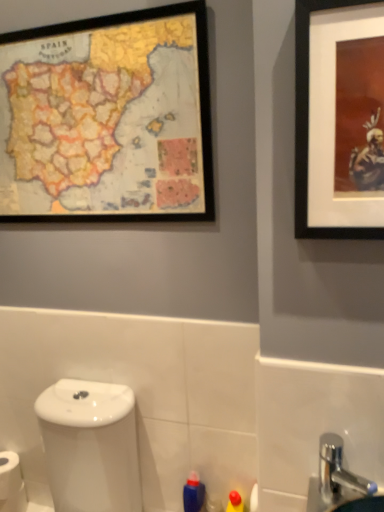
This screenshot has width=384, height=512. What do you see at coordinates (11, 483) in the screenshot? I see `white matte toilet paper at lower left` at bounding box center [11, 483].

Where is `white glossy toilet at lower left`? Image resolution: width=384 pixels, height=512 pixels. white glossy toilet at lower left is located at coordinates (90, 446).

Identify the location of blue plastic bottle at lower center. click(193, 493).

In the scene shown: Would you say silver metallic faucet at lower right is a long distance from white glossy toilet at lower left?

silver metallic faucet at lower right is actually quite close to white glossy toilet at lower left.

Consider the image. Which is more to the right, silver metallic faucet at lower right or white glossy toilet at lower left?

From the viewer's perspective, silver metallic faucet at lower right appears more on the right side.

Is point (325, 471) closer or farther from the camera than point (59, 398)?

Point (325, 471) appears to be closer to the viewer than point (59, 398).

From a real-world perspective, who is located lower, silver metallic faucet at lower right or white glossy toilet at lower left?

white glossy toilet at lower left.

Is blue plastic bottle at lower center looking in the opposite direction of black matte picture frame at upper right, which is counted as the second picture frame, starting from the left?

No, blue plastic bottle at lower center is not facing the opposite direction of black matte picture frame at upper right, which is counted as the second picture frame, starting from the left.

From a real-world perspective, does blue plastic bottle at lower center stand above black matte picture frame at upper right, the second picture frame positioned from the back?

No, from a real-world perspective, blue plastic bottle at lower center is not above black matte picture frame at upper right, the second picture frame positioned from the back.

Is blue plastic bottle at lower center further to the viewer compared to black matte picture frame at upper right, which is counted as the second picture frame, starting from the left?

Yes, the depth of blue plastic bottle at lower center is greater than that of black matte picture frame at upper right, which is counted as the second picture frame, starting from the left.

Find the location of `picture frame that is the 1st one above the blue plastic bottle at lower center (from a real-world perspective)`. picture frame that is the 1st one above the blue plastic bottle at lower center (from a real-world perspective) is located at coordinates (339, 119).

Considering the sizes of objects wooden map at upper left, which is counted as the 2th picture frame, starting from the front, and white matte toilet paper at lower left in the image provided, who is wider, wooden map at upper left, which is counted as the 2th picture frame, starting from the front, or white matte toilet paper at lower left?

With larger width is white matte toilet paper at lower left.

From the image's perspective, does wooden map at upper left, which is counted as the 2th picture frame, starting from the right, appear higher than white matte toilet paper at lower left?

Yes.

From a real-world perspective, is wooden map at upper left, acting as the 1th picture frame starting from the left, on white matte toilet paper at lower left?

Yes, from a real-world perspective, wooden map at upper left, acting as the 1th picture frame starting from the left, is over white matte toilet paper at lower left

Considering the positions of objects black matte picture frame at upper right, which is counted as the first picture frame, starting from the front, and white matte toilet paper at lower left in the image provided, who is more to the left, black matte picture frame at upper right, which is counted as the first picture frame, starting from the front, or white matte toilet paper at lower left?

Positioned to the left is white matte toilet paper at lower left.

Is black matte picture frame at upper right, which is counted as the first picture frame, starting from the front, taller or shorter than white matte toilet paper at lower left?

black matte picture frame at upper right, which is counted as the first picture frame, starting from the front, is taller than white matte toilet paper at lower left.

Considering the positions of points (309, 113) and (20, 472), is point (309, 113) closer to camera compared to point (20, 472)?

Yes, it is in front of point (20, 472).

Considering the relative sizes of black matte picture frame at upper right, which is the 1th picture frame from right to left, and white matte toilet paper at lower left in the image provided, is black matte picture frame at upper right, which is the 1th picture frame from right to left, wider than white matte toilet paper at lower left?

No, black matte picture frame at upper right, which is the 1th picture frame from right to left, is not wider than white matte toilet paper at lower left.

From a real-world perspective, who is located higher, silver metallic faucet at lower right or wooden map at upper left, acting as the first picture frame starting from the back?

From a 3D spatial view, wooden map at upper left, acting as the first picture frame starting from the back, is above.

Looking at this image, is silver metallic faucet at lower right facing towards wooden map at upper left, which is counted as the 2th picture frame, starting from the right?

No, silver metallic faucet at lower right is not turned towards wooden map at upper left, which is counted as the 2th picture frame, starting from the right.

Is silver metallic faucet at lower right positioned beyond the bounds of wooden map at upper left, acting as the 1th picture frame starting from the left?

Yes, silver metallic faucet at lower right is located beyond the bounds of wooden map at upper left, acting as the 1th picture frame starting from the left.

From a real-world perspective, which is physically below, wooden map at upper left, which is counted as the 2th picture frame, starting from the right, or white glossy toilet at lower left?

In real-world perspective, white glossy toilet at lower left is lower.

Measure the distance between wooden map at upper left, which is counted as the 2th picture frame, starting from the right, and white glossy toilet at lower left.

wooden map at upper left, which is counted as the 2th picture frame, starting from the right, is 29.01 inches away from white glossy toilet at lower left.

Based on their sizes in the image, would you say wooden map at upper left, acting as the 1th picture frame starting from the left, is bigger or smaller than white glossy toilet at lower left?

In the image, wooden map at upper left, acting as the 1th picture frame starting from the left, appears to be smaller than white glossy toilet at lower left.

In terms of height, does white glossy toilet at lower left look taller or shorter compared to black matte picture frame at upper right, which is counted as the first picture frame, starting from the front?

Considering their sizes, white glossy toilet at lower left has more height than black matte picture frame at upper right, which is counted as the first picture frame, starting from the front.

From the image's perspective, is white glossy toilet at lower left beneath black matte picture frame at upper right, which is counted as the first picture frame, starting from the front?

Yes, from the image's perspective, white glossy toilet at lower left is beneath black matte picture frame at upper right, which is counted as the first picture frame, starting from the front.

Between white glossy toilet at lower left and black matte picture frame at upper right, which is the 1th picture frame from right to left, which one has smaller size?

black matte picture frame at upper right, which is the 1th picture frame from right to left, is smaller.

How much distance is there between white glossy toilet at lower left and black matte picture frame at upper right, the second picture frame positioned from the back?

white glossy toilet at lower left and black matte picture frame at upper right, the second picture frame positioned from the back, are 36.96 inches apart from each other.

In the image, there is a silver metallic faucet at lower right. Where is `toilet below it (from a real-world perspective)`? toilet below it (from a real-world perspective) is located at coordinates (90, 446).

You are a GUI agent. You are given a task and a screenshot of the screen. Output one action in this format:
    pyautogui.click(x=<x>, y=<y>)
    Task: Click on the picture frame on the right of the blue plastic bottle at lower center
    The height and width of the screenshot is (512, 384).
    Given the screenshot: What is the action you would take?
    pyautogui.click(x=339, y=119)

Which object lies nearer to the anchor point blue plastic bottle at lower center, wooden map at upper left, which is counted as the 2th picture frame, starting from the right, or white matte toilet paper at lower left?

white matte toilet paper at lower left is positioned closer to the anchor blue plastic bottle at lower center.

Estimate the real-world distances between objects in this image. Which object is closer to white matte toilet paper at lower left, silver metallic faucet at lower right or blue plastic bottle at lower center?

blue plastic bottle at lower center is positioned closer to the anchor white matte toilet paper at lower left.

Estimate the real-world distances between objects in this image. Which object is closer to silver metallic faucet at lower right, white glossy toilet at lower left or wooden map at upper left, acting as the 1th picture frame starting from the left?

white glossy toilet at lower left lies closer to silver metallic faucet at lower right than the other object.

Looking at the image, which one is located closer to white matte toilet paper at lower left, silver metallic faucet at lower right or wooden map at upper left, which is counted as the 2th picture frame, starting from the right?

silver metallic faucet at lower right is positioned closer to the anchor white matte toilet paper at lower left.

From the image, which object appears to be farther from white glossy toilet at lower left, blue plastic bottle at lower center or silver metallic faucet at lower right?

silver metallic faucet at lower right.

Which object lies further to the anchor point silver metallic faucet at lower right, white glossy toilet at lower left or black matte picture frame at upper right, which is the 1th picture frame from right to left?

black matte picture frame at upper right, which is the 1th picture frame from right to left, is further to silver metallic faucet at lower right.

Which object lies nearer to the anchor point wooden map at upper left, which is counted as the 2th picture frame, starting from the front, white matte toilet paper at lower left or blue plastic bottle at lower center?

blue plastic bottle at lower center is positioned closer to the anchor wooden map at upper left, which is counted as the 2th picture frame, starting from the front.

Looking at this image, from the image, which object appears to be nearer to silver metallic faucet at lower right, blue plastic bottle at lower center or wooden map at upper left, acting as the 1th picture frame starting from the left?

Among the two, blue plastic bottle at lower center is located nearer to silver metallic faucet at lower right.

Locate an element on the screen. The width and height of the screenshot is (384, 512). sink that lies between wooden map at upper left, which is counted as the 2th picture frame, starting from the front, and white matte toilet paper at lower left from top to bottom is located at coordinates (339, 482).

The image size is (384, 512). I want to click on picture frame that lies between wooden map at upper left, which is counted as the 2th picture frame, starting from the right, and white glossy toilet at lower left from top to bottom, so click(x=339, y=119).

Image resolution: width=384 pixels, height=512 pixels. Identify the location of toiletry located between white matte toilet paper at lower left and silver metallic faucet at lower right in the left-right direction. (193, 493).

At what (x,y) coordinates should I click in order to perform the action: click on toilet between black matte picture frame at upper right, which is the 1th picture frame from right to left, and blue plastic bottle at lower center from top to bottom. Please return your answer as a coordinate pair (x, y). This screenshot has height=512, width=384. Looking at the image, I should click on (90, 446).